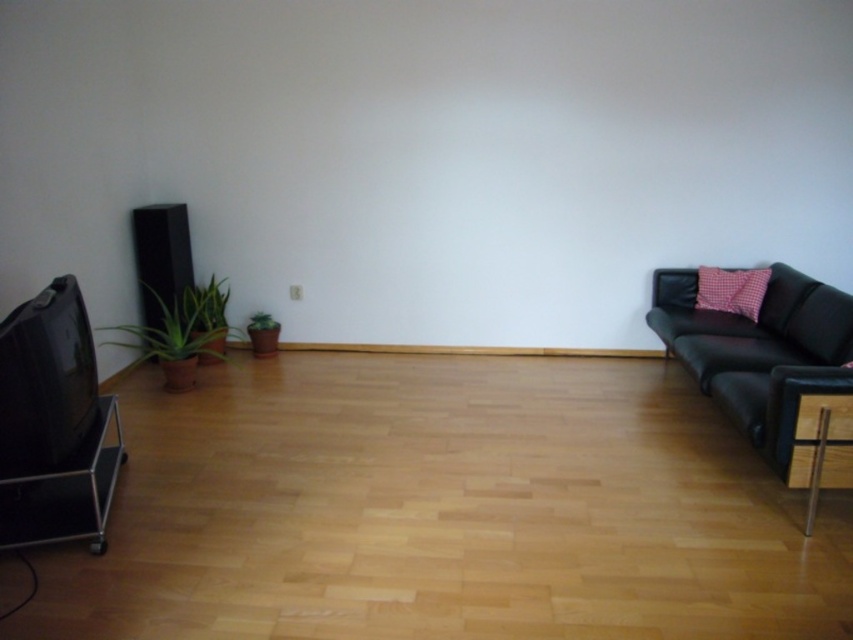
Question: Does pink checkered pillow at right appear on the right side of green matte plant at lower left?

Choices:
 (A) yes
 (B) no

Answer: (A)

Question: In this image, where is pink checkered pillow at right located relative to green matte plant at lower left?

Choices:
 (A) right
 (B) left

Answer: (A)

Question: Is green matte plant at left above pink checkered pillow at right?

Choices:
 (A) yes
 (B) no

Answer: (B)

Question: Estimate the real-world distances between objects in this image. Which object is farther from the green matte plant at left?

Choices:
 (A) green matte plant at lower left
 (B) pink checkered pillow at right
 (C) black leather couch at right

Answer: (B)

Question: Which object is positioned farthest from the green matte plant at left?

Choices:
 (A) green matte plant at lower left
 (B) black leather couch at right

Answer: (B)

Question: Which object is closer to the camera taking this photo?

Choices:
 (A) pink checkered pillow at right
 (B) black leather couch at right
 (C) green matte plant at left
 (D) green matte plant at lower left

Answer: (B)